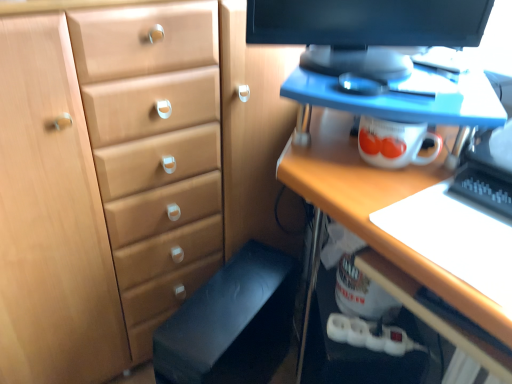
Describe the element at coordinates (365, 31) in the screenshot. I see `black glossy monitor at upper center` at that location.

This screenshot has height=384, width=512. Describe the element at coordinates (231, 323) in the screenshot. I see `black fabric computer chair at lower center` at that location.

Locate an element on the screen. The image size is (512, 384). black fabric computer chair at lower center is located at coordinates (231, 323).

This screenshot has height=384, width=512. What do you see at coordinates (126, 176) in the screenshot?
I see `light brown wood chest of drawers at center` at bounding box center [126, 176].

You are a GUI agent. You are given a task and a screenshot of the screen. Output one action in this format:
    pyautogui.click(x=<x>, y=<y>)
    Task: Click on the light brown wood chest of drawers at center
    This screenshot has height=384, width=512.
    Given the screenshot: What is the action you would take?
    pyautogui.click(x=126, y=176)

Consider the image. Measure the distance between point (319,141) and camera.

The distance of point (319,141) from camera is 35.91 inches.

At what (x,y) coordinates should I click in order to perform the action: click on black glossy monitor at upper center. Please return your answer as a coordinate pair (x, y). The image size is (512, 384). Looking at the image, I should click on (365, 31).

How many degrees apart are the facing directions of light brown wood chest of drawers at center and black fabric computer chair at lower center?

67.3 degrees separate the facing orientations of light brown wood chest of drawers at center and black fabric computer chair at lower center.

Which object is thinner, light brown wood chest of drawers at center or black fabric computer chair at lower center?

Thinner between the two is light brown wood chest of drawers at center.

Can you confirm if light brown wood chest of drawers at center is positioned to the right of black fabric computer chair at lower center?

In fact, light brown wood chest of drawers at center is to the left of black fabric computer chair at lower center.

From a real-world perspective, does light brown wood chest of drawers at center sit lower than black fabric computer chair at lower center?

Actually, light brown wood chest of drawers at center is physically above black fabric computer chair at lower center in the real world.

Does black fabric computer chair at lower center appear on the left side of matte wood desk at upper right?

Yes.

Which is in front, point (168, 350) or point (362, 213)?

The point (362, 213) is closer.

Can you confirm if black fabric computer chair at lower center is smaller than matte wood desk at upper right?

Yes, black fabric computer chair at lower center is smaller than matte wood desk at upper right.

Which object is positioned more to the right, black glossy monitor at upper center or light brown wood chest of drawers at center?

black glossy monitor at upper center is more to the right.

Locate an element on the screen. This screenshot has width=512, height=384. computer monitor behind the light brown wood chest of drawers at center is located at coordinates (365, 31).

Is the depth of black glossy monitor at upper center greater than that of light brown wood chest of drawers at center?

Yes.

Looking at this image, can you confirm if black glossy monitor at upper center is wider than light brown wood chest of drawers at center?

In fact, black glossy monitor at upper center might be narrower than light brown wood chest of drawers at center.

Consider the image. Does light brown wood chest of drawers at center have a greater height compared to black glossy monitor at upper center?

Indeed, light brown wood chest of drawers at center has a greater height compared to black glossy monitor at upper center.

Between light brown wood chest of drawers at center and black glossy monitor at upper center, which one appears on the left side from the viewer's perspective?

From the viewer's perspective, light brown wood chest of drawers at center appears more on the left side.

From the picture: Which object is wider, light brown wood chest of drawers at center or black glossy monitor at upper center?

Wider between the two is light brown wood chest of drawers at center.

Is point (506, 316) positioned in front of point (243, 344)?

Yes, point (506, 316) is in front of point (243, 344).

Is matte wood desk at upper right positioned behind black fabric computer chair at lower center?

No, matte wood desk at upper right is in front of black fabric computer chair at lower center.

From a real-world perspective, which is physically below, matte wood desk at upper right or black fabric computer chair at lower center?

black fabric computer chair at lower center.

Considering the sizes of black glossy monitor at upper center and matte wood desk at upper right in the image, is black glossy monitor at upper center wider or thinner than matte wood desk at upper right?

black glossy monitor at upper center is thinner than matte wood desk at upper right.

From the image's perspective, between black glossy monitor at upper center and matte wood desk at upper right, who is located below?

Answer: From the image's view, matte wood desk at upper right is below.

How different are the orientations of black glossy monitor at upper center and matte wood desk at upper right in degrees?

57.2 degrees.

Looking at the image, does black glossy monitor at upper center seem bigger or smaller compared to matte wood desk at upper right?

In the image, black glossy monitor at upper center appears to be smaller than matte wood desk at upper right.

At what (x,y) coordinates should I click in order to perform the action: click on desk on the right of light brown wood chest of drawers at center. Please return your answer as a coordinate pair (x, y). The width and height of the screenshot is (512, 384). Looking at the image, I should click on (386, 232).

From a real-world perspective, is matte wood desk at upper right located higher than light brown wood chest of drawers at center?

No, from a real-world perspective, matte wood desk at upper right is not on top of light brown wood chest of drawers at center.

From the image's perspective, is matte wood desk at upper right over light brown wood chest of drawers at center?

A: Incorrect, from the image's perspective, matte wood desk at upper right is lower than light brown wood chest of drawers at center.

This screenshot has width=512, height=384. I want to click on computer chair that is behind the light brown wood chest of drawers at center, so click(x=231, y=323).

Where is `desk above the black fabric computer chair at lower center (from the image's perspective)`? This screenshot has width=512, height=384. desk above the black fabric computer chair at lower center (from the image's perspective) is located at coordinates (386, 232).

From the image, which object appears to be nearer to light brown wood chest of drawers at center, black fabric computer chair at lower center or black glossy monitor at upper center?

black fabric computer chair at lower center is closer to light brown wood chest of drawers at center.

Based on the photo, when comparing their distances from black fabric computer chair at lower center, does black glossy monitor at upper center or light brown wood chest of drawers at center seem further?

The object further to black fabric computer chair at lower center is black glossy monitor at upper center.

Considering their positions, is black glossy monitor at upper center positioned closer to light brown wood chest of drawers at center than matte wood desk at upper right?

The object closer to light brown wood chest of drawers at center is black glossy monitor at upper center.

Considering their positions, is light brown wood chest of drawers at center positioned further to black glossy monitor at upper center than black fabric computer chair at lower center?

black fabric computer chair at lower center lies further to black glossy monitor at upper center than the other object.

From the image, which object appears to be nearer to black fabric computer chair at lower center, light brown wood chest of drawers at center or black glossy monitor at upper center?

light brown wood chest of drawers at center is positioned closer to the anchor black fabric computer chair at lower center.

Looking at the image, which one is located further to light brown wood chest of drawers at center, black glossy monitor at upper center or black fabric computer chair at lower center?

Among the two, black glossy monitor at upper center is located further to light brown wood chest of drawers at center.

When comparing their distances from black fabric computer chair at lower center, does black glossy monitor at upper center or matte wood desk at upper right seem further?

Among the two, black glossy monitor at upper center is located further to black fabric computer chair at lower center.

Estimate the real-world distances between objects in this image. Which object is closer to black fabric computer chair at lower center, light brown wood chest of drawers at center or matte wood desk at upper right?

Based on the image, light brown wood chest of drawers at center appears to be nearer to black fabric computer chair at lower center.

Where is `desk located between light brown wood chest of drawers at center and black glossy monitor at upper center in the left-right direction`? desk located between light brown wood chest of drawers at center and black glossy monitor at upper center in the left-right direction is located at coordinates (386, 232).

At what (x,y) coordinates should I click in order to perform the action: click on computer chair situated between light brown wood chest of drawers at center and matte wood desk at upper right from left to right. Please return your answer as a coordinate pair (x, y). The width and height of the screenshot is (512, 384). Looking at the image, I should click on (231, 323).

Identify the location of chest of drawers between black glossy monitor at upper center and black fabric computer chair at lower center in the vertical direction. Image resolution: width=512 pixels, height=384 pixels. (126, 176).

I want to click on desk between black glossy monitor at upper center and black fabric computer chair at lower center in the vertical direction, so click(x=386, y=232).